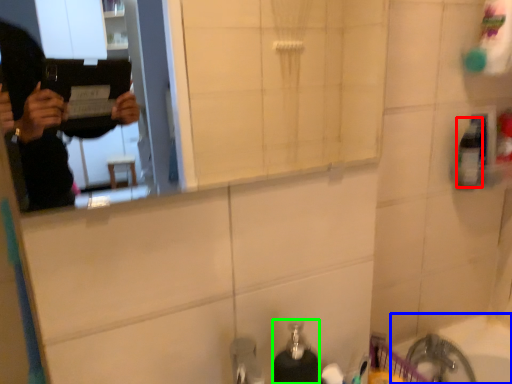
Question: Estimate the real-world distances between objects in this image. Which object is closer to mouthwash (highlighted by a red box), bath (highlighted by a blue box) or soap dispenser (highlighted by a green box)?

Choices:
 (A) bath
 (B) soap dispenser

Answer: (A)